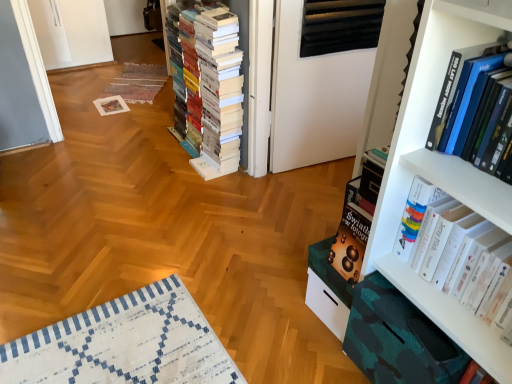
Where is `free space on the front side of white matte book at center, acting as the first book starting from the left`? This screenshot has height=384, width=512. free space on the front side of white matte book at center, acting as the first book starting from the left is located at coordinates (181, 194).